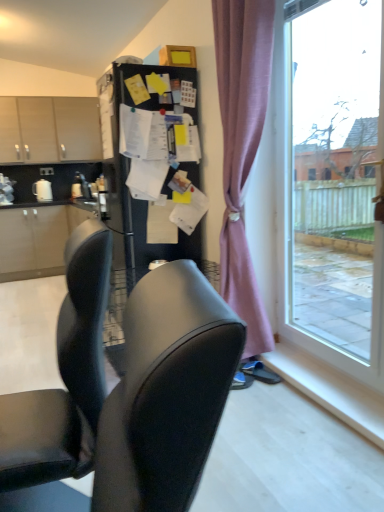
Question: Does pink fabric curtain at right have a smaller size compared to white glossy paper towel dispenser at left?

Choices:
 (A) yes
 (B) no

Answer: (B)

Question: Does pink fabric curtain at right touch white glossy paper towel dispenser at left?

Choices:
 (A) no
 (B) yes

Answer: (A)

Question: Does pink fabric curtain at right have a greater height compared to white glossy paper towel dispenser at left?

Choices:
 (A) no
 (B) yes

Answer: (B)

Question: Is pink fabric curtain at right to the left of white glossy paper towel dispenser at left from the viewer's perspective?

Choices:
 (A) yes
 (B) no

Answer: (B)

Question: Considering the relative positions of pink fabric curtain at right and white glossy paper towel dispenser at left in the image provided, is pink fabric curtain at right behind white glossy paper towel dispenser at left?

Choices:
 (A) no
 (B) yes

Answer: (A)

Question: Is point (236, 210) positioned closer to the camera than point (29, 436)?

Choices:
 (A) closer
 (B) farther

Answer: (B)

Question: Is pink fabric curtain at right taller or shorter than black fabric chair at center?

Choices:
 (A) short
 (B) tall

Answer: (B)

Question: From the image's perspective, is pink fabric curtain at right positioned above or below black fabric chair at center?

Choices:
 (A) above
 (B) below

Answer: (A)

Question: In the image, is pink fabric curtain at right on the left side or the right side of black fabric chair at center?

Choices:
 (A) left
 (B) right

Answer: (B)

Question: Is pink fabric curtain at right inside the boundaries of white glossy paper towel dispenser at left, or outside?

Choices:
 (A) outside
 (B) inside

Answer: (A)

Question: Looking at their shapes, would you say pink fabric curtain at right is wider or thinner than white glossy paper towel dispenser at left?

Choices:
 (A) wide
 (B) thin

Answer: (A)

Question: From the image's perspective, is pink fabric curtain at right above or below white glossy paper towel dispenser at left?

Choices:
 (A) above
 (B) below

Answer: (B)

Question: From a real-world perspective, is pink fabric curtain at right physically located above or below white glossy paper towel dispenser at left?

Choices:
 (A) below
 (B) above

Answer: (B)

Question: Does point (51, 197) appear closer or farther from the camera than point (374, 258)?

Choices:
 (A) farther
 (B) closer

Answer: (A)

Question: From the image's perspective, is white glossy paper towel dispenser at left above or below transparent glass window at right?

Choices:
 (A) below
 (B) above

Answer: (B)